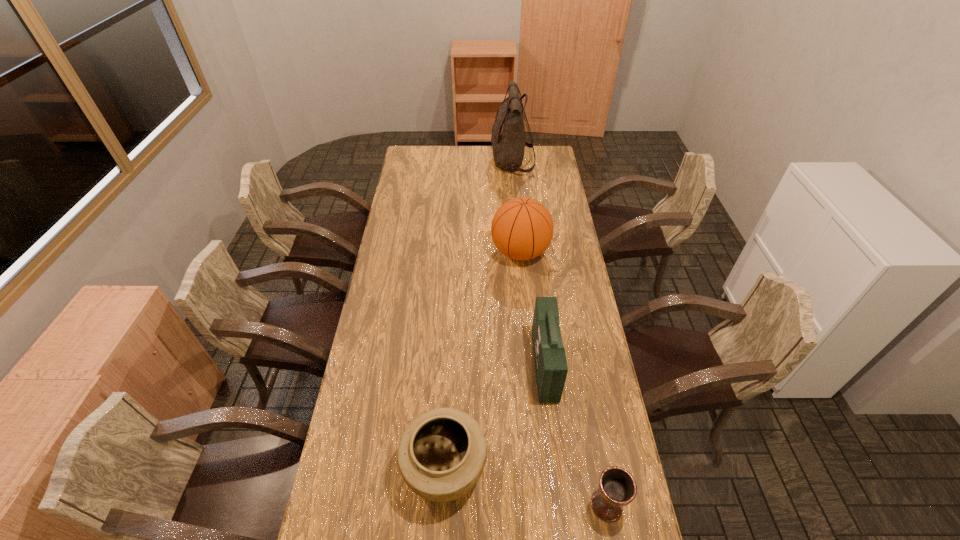
This screenshot has height=540, width=960. I want to click on chalice situated at the right edge, so click(617, 488).

The image size is (960, 540). I want to click on object that is at the far right corner, so click(508, 143).

This screenshot has width=960, height=540. In the image, there is a desktop. Identify the location of blank space at the far edge. (461, 165).

Find the location of a particular element. Image resolution: width=960 pixels, height=540 pixels. free spot at the left edge of the desktop is located at coordinates (424, 229).

Identify the location of free space at the right edge of the desktop. The width and height of the screenshot is (960, 540). (529, 173).

This screenshot has height=540, width=960. I want to click on vacant space at the far right corner of the desktop, so click(x=537, y=166).

What are the coordinates of `empty space between the backpack and the pottery` in the screenshot? It's located at (478, 315).

Where is `empty space that is in between the fourth nearest object and the third shortest object`? empty space that is in between the fourth nearest object and the third shortest object is located at coordinates (533, 309).

Find the location of a particular element. This screenshot has width=960, height=540. empty location between the pottery and the farthest object is located at coordinates (478, 315).

Where is `vacant space that is in between the leftmost object and the third farthest object`? vacant space that is in between the leftmost object and the third farthest object is located at coordinates (494, 417).